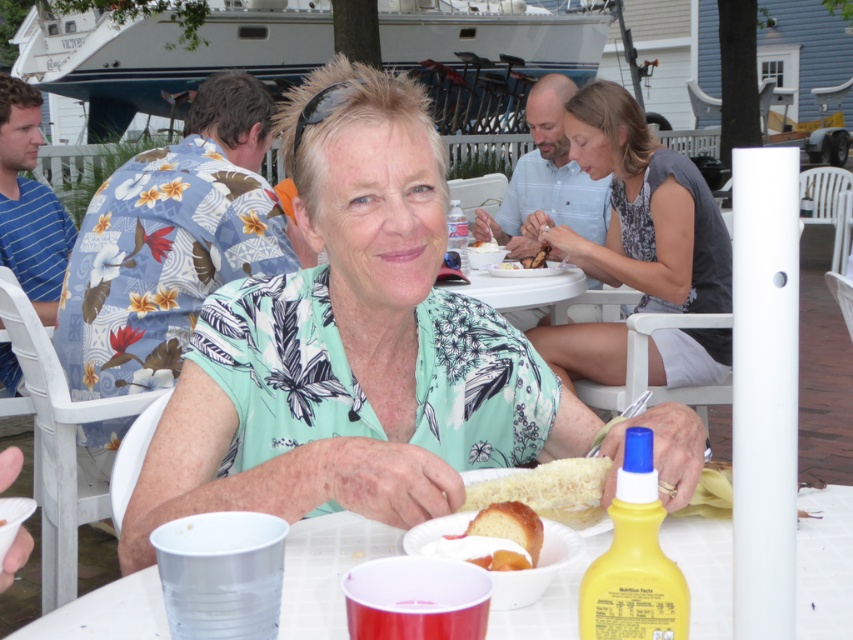
You are a photographer taking a picture of the green floral shirt at center and the white fluffy bread at center. Which object should you zoom in on to make them appear the same size in the photo?

The green floral shirt at center is bigger than the white fluffy bread at center, so you should zoom in more on the white fluffy bread at center to make them appear the same size in the photo.

Looking at this image, you are sitting at the white table in the outdoor dining scene. You notice two points marked on the table surface. The first point is at coordinates point (194, 417) and the second point is at point (483, 250). From your seated position, which point is closer to you?

Point (194, 417) is in front of point (483, 250), so from your seated position, point (194, 417) is closer to you.

You are a photographer trying to capture a closeup of the white fluffy bread at center. The woman in the green floral shirt at center is blocking your view. Can you move the bread closer to the camera without moving the woman?

The green floral shirt at center is closer to the viewer than the white fluffy bread at center, so moving the bread closer to the camera would require moving it in front of the shirt, which might not be possible without moving the woman.